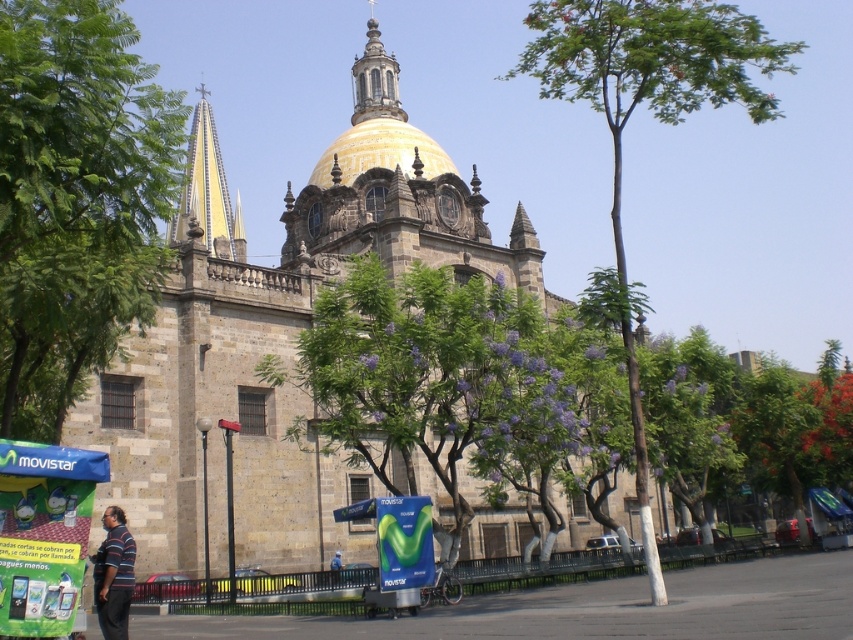
You are standing in front of the grand historical building and want to walk from the point marked at coordinate point (753, 45) to the point marked at coordinate point (329, 576). Which direction should you move relative to the building?

You should move towards the right side of the building because point (753, 45) is to the left of point (329, 576).

You are standing at the point with coordinates of 0.5, 0.3. You want to go to the stone church at center. In which direction should you move?

The stone church at center is located at point (x=287, y=336). Since you are at (x=254, y=320), you should move northeast to reach it.

You are standing at the entrance of the grand historical building and want to plant a new tree exactly at the same position as the green leafy tree at center. What are the coordinates where you should plant the new tree?

The coordinates for the green leafy tree at center are at point (648, 109), so you should plant the new tree at those coordinates.